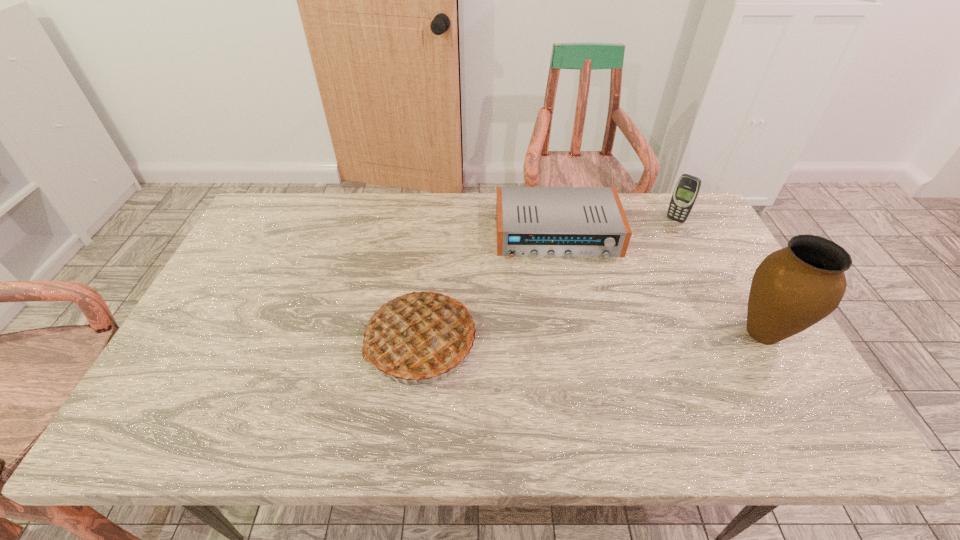
You are a GUI agent. You are given a task and a screenshot of the screen. Output one action in this format:
    pyautogui.click(x=<x>, y=<y>)
    Task: Click on the free spot between the urn and the pie
    This screenshot has width=960, height=540.
    Given the screenshot: What is the action you would take?
    pyautogui.click(x=592, y=337)

I want to click on empty location between the radio receiver and the pie, so click(x=490, y=288).

The image size is (960, 540). What are the coordinates of `free space between the second shortest object and the leftmost object` in the screenshot? It's located at (548, 281).

The image size is (960, 540). I want to click on free area in between the third object from right to left and the tallest object, so click(660, 284).

You are a GUI agent. You are given a task and a screenshot of the screen. Output one action in this format:
    pyautogui.click(x=<x>, y=<y>)
    Task: Click on the vacant space that's between the cellular telephone and the pie
    Image resolution: width=960 pixels, height=540 pixels.
    Given the screenshot: What is the action you would take?
    pyautogui.click(x=548, y=281)

Locate an element on the screen. The image size is (960, 540). free spot between the shortest object and the second tallest object is located at coordinates (490, 288).

Identify which object is the third closest to the cellular telephone. Please provide its 2D coordinates. Your answer should be formatted as a tuple, i.e. [(x, y)], where the tuple contains the x and y coordinates of a point satisfying the conditions above.

[(420, 336)]

Locate which object is the closest to the cellular telephone. Please provide its 2D coordinates. Your answer should be formatted as a tuple, i.e. [(x, y)], where the tuple contains the x and y coordinates of a point satisfying the conditions above.

[(568, 222)]